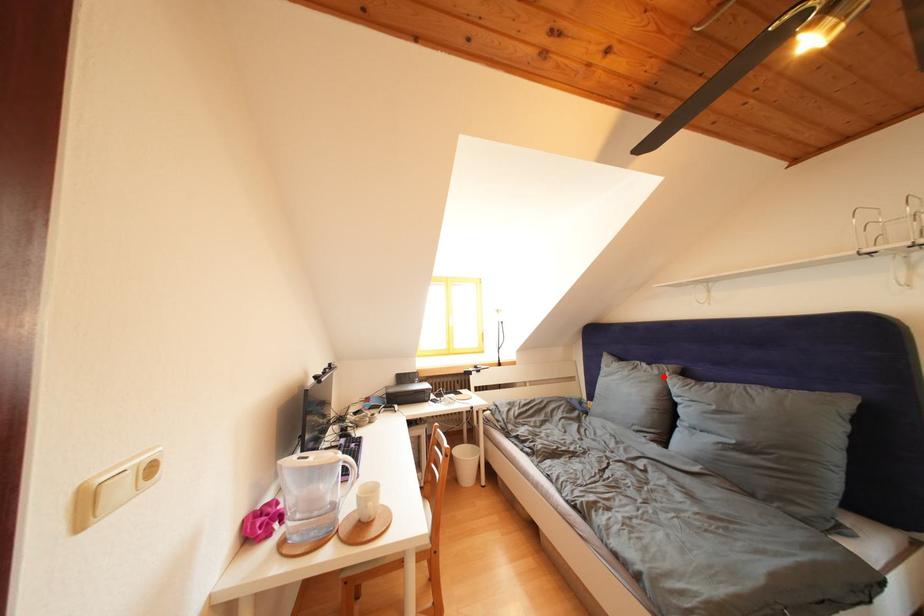
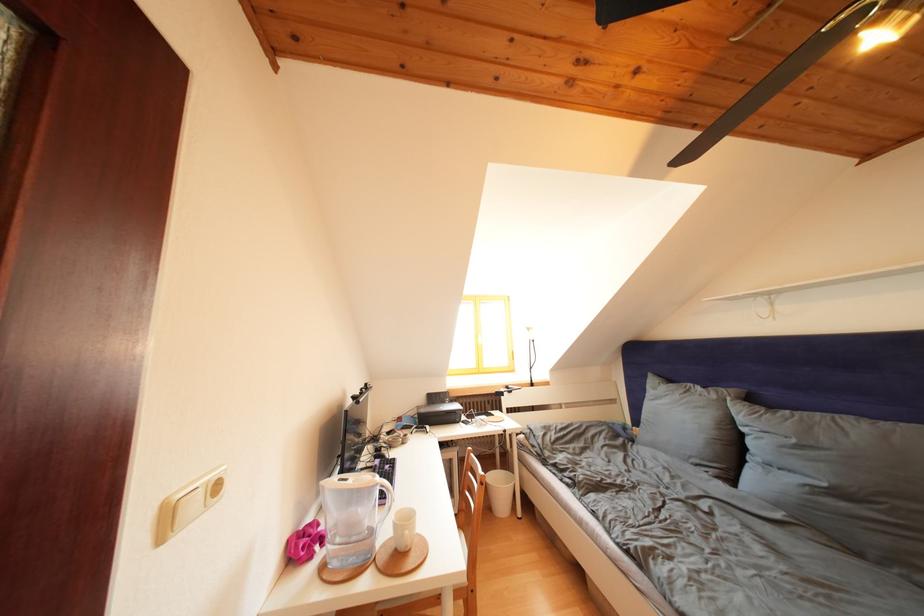
Where in the second image is the point corresponding to the highlighted location from the first image?

(722, 402)